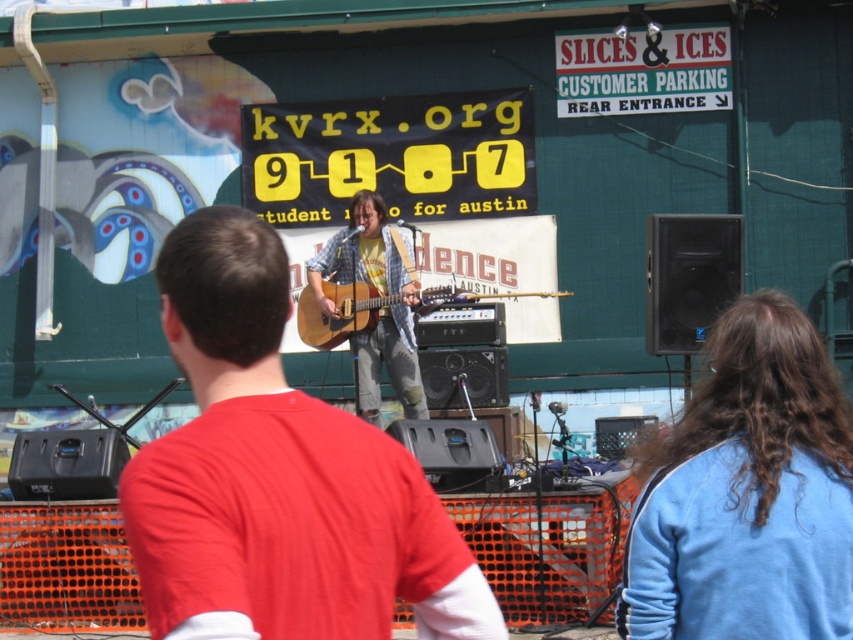
Question: Is matte brown guitar at center smaller than acoustic wood guitar at center?

Choices:
 (A) yes
 (B) no

Answer: (A)

Question: Considering the real-world distances, which object is farthest from the acoustic wood guitar at center?

Choices:
 (A) matte brown guitar at center
 (B) matte yellow shirt at center

Answer: (A)

Question: Among these points, which one is nearest to the camera?

Choices:
 (A) (277, 470)
 (B) (370, 321)

Answer: (A)

Question: Which object is farther from the camera taking this photo?

Choices:
 (A) matte brown guitar at center
 (B) acoustic wood guitar at center

Answer: (B)

Question: Is matte brown guitar at center wider than acoustic wood guitar at center?

Choices:
 (A) yes
 (B) no

Answer: (B)

Question: Does matte brown guitar at center have a larger size compared to matte yellow shirt at center?

Choices:
 (A) no
 (B) yes

Answer: (A)